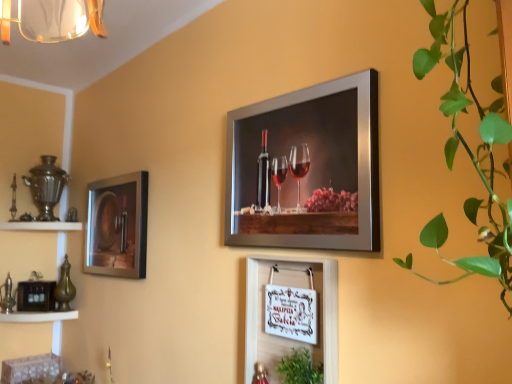
Question: Considering the relative positions of green leafy plant at right and white wood sign at center, which appears as the 2th picture frame when viewed from the left, in the image provided, is green leafy plant at right to the left or to the right of white wood sign at center, which appears as the 2th picture frame when viewed from the left,?

Choices:
 (A) left
 (B) right

Answer: (B)

Question: Considering the positions of green leafy plant at right and white wood sign at center, which appears as the 2th picture frame when viewed from the left, in the image, is green leafy plant at right bigger or smaller than white wood sign at center, which appears as the 2th picture frame when viewed from the left,?

Choices:
 (A) small
 (B) big

Answer: (B)

Question: Estimate the real-world distances between objects in this image. Which object is closer to the green leafy plant at lower center?

Choices:
 (A) white wood sign at center, which appears as the second picture frame when viewed from the front
 (B) white wood shelf at lower left
 (C) metallic silver wine bottle at left, which ranks as the 1th picture frame in back-to-front order
 (D) metallic silver picture frame at upper center, the first picture frame when ordered from right to left
 (E) green leafy plant at right

Answer: (A)

Question: Based on their relative distances, which object is farther from the green leafy plant at lower center?

Choices:
 (A) white wood sign at center, marked as the second picture frame in a right-to-left arrangement
 (B) white wood shelf at lower left
 (C) metallic silver picture frame at upper center, the first picture frame when ordered from right to left
 (D) green leafy plant at right
 (E) metallic silver wine bottle at left, the third picture frame in the right-to-left sequence

Answer: (B)